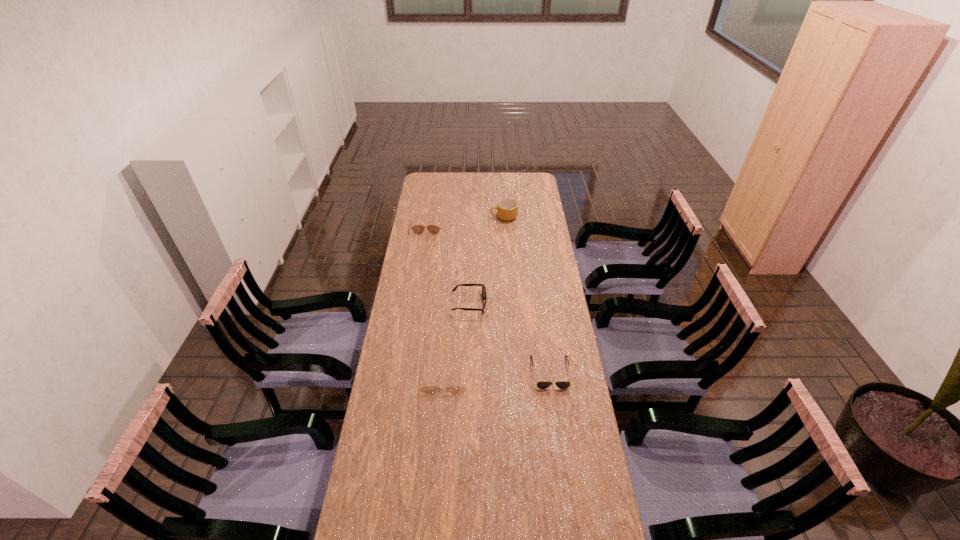
Locate an element on the screen. Image resolution: width=960 pixels, height=540 pixels. object present at the right edge is located at coordinates (541, 384).

I want to click on vacant area at the far edge, so click(456, 175).

Locate an element on the screen. This screenshot has width=960, height=540. free location at the left edge of the desktop is located at coordinates (406, 260).

In order to click on vacant space at the right edge of the desktop in this screenshot , I will do `click(518, 217)`.

Find the location of `free space between the second farthest sunglasses and the farthest sunglasses`. free space between the second farthest sunglasses and the farthest sunglasses is located at coordinates (448, 265).

Where is `free space between the third nearest sunglasses and the tallest object`? Image resolution: width=960 pixels, height=540 pixels. free space between the third nearest sunglasses and the tallest object is located at coordinates (487, 261).

The width and height of the screenshot is (960, 540). I want to click on vacant space that's between the rightmost sunglasses and the mug, so click(x=527, y=294).

The image size is (960, 540). I want to click on unoccupied area between the farthest sunglasses and the third nearest object, so click(448, 265).

Where is `vacant area between the third farthest object and the rightmost sunglasses`? vacant area between the third farthest object and the rightmost sunglasses is located at coordinates (510, 338).

This screenshot has width=960, height=540. Find the location of `vacant region between the farthest sunglasses and the rightmost sunglasses`. vacant region between the farthest sunglasses and the rightmost sunglasses is located at coordinates coord(489,299).